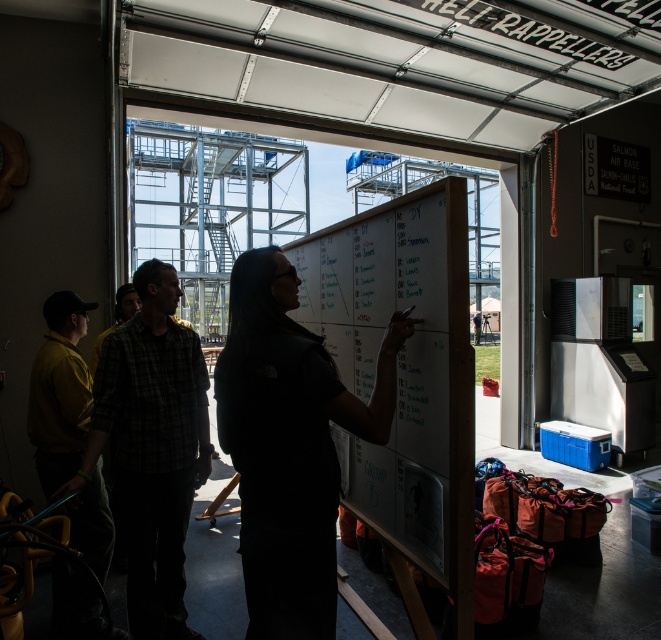
You are part of the team in the image and need to know which object is larger between the whiteboard at center and the plaid fabric shirt at center. Can you determine this?

The whiteboard at center is bigger than the plaid fabric shirt at center according to the description.

You are standing in the room and see two points marked on the whiteboard. Which point, point (401, 211) or point (225, 429), is closer to you?

Point (225, 429) is closer to you because it is less further to the viewer than point (401, 211).